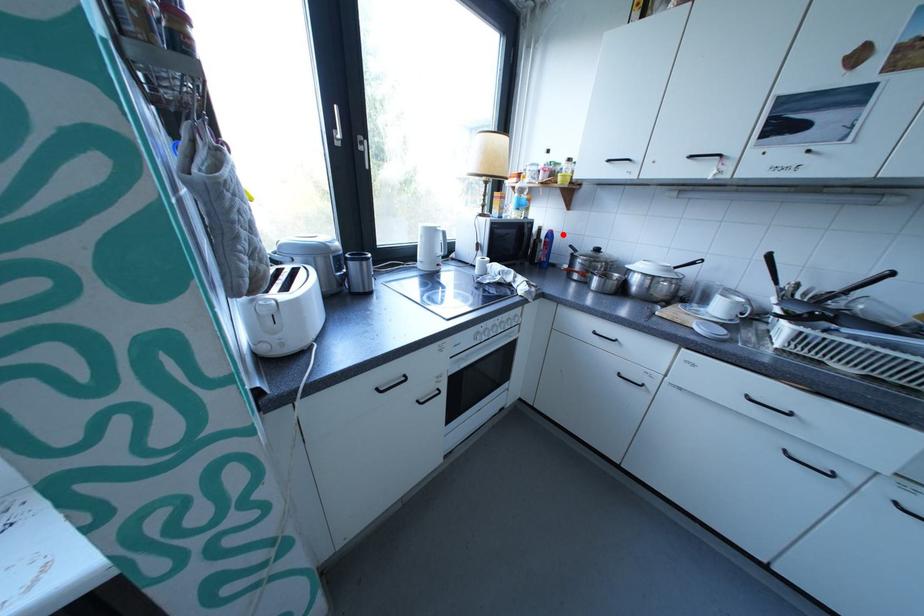
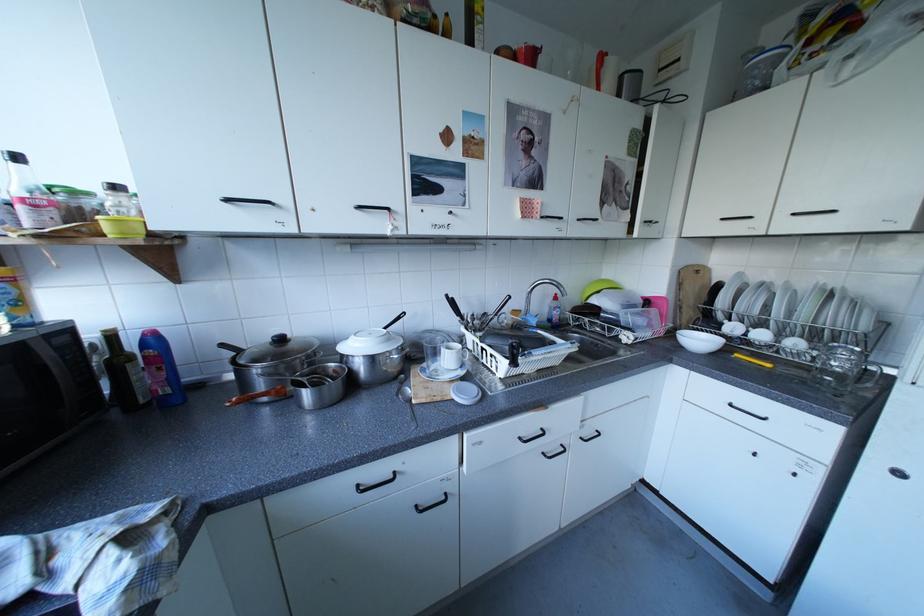
The point at the highlighted location is marked in the first image. Where is the corresponding point in the second image?

(165, 339)